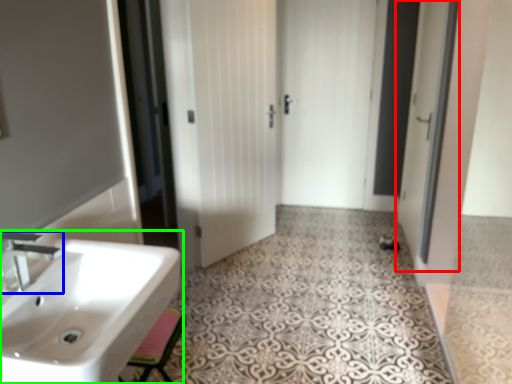
Question: Estimate the real-world distances between objects in this image. Which object is closer to screen door (highlighted by a red box), tap (highlighted by a blue box) or sink (highlighted by a green box)?

Choices:
 (A) tap
 (B) sink

Answer: (B)